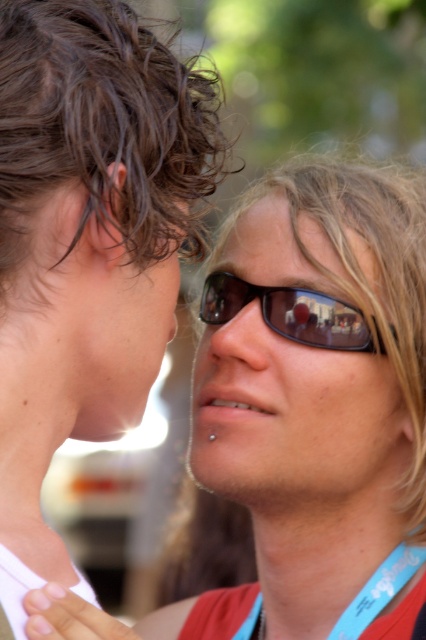
Does matte white face at left have a lesser height compared to matte black nose at center?

In fact, matte white face at left may be taller than matte black nose at center.

Between matte white face at left and matte black nose at center, which one appears on the left side from the viewer's perspective?

matte black nose at center is more to the left.

Is point (412, 620) closer to viewer compared to point (238, 317)?

Yes, point (412, 620) is in front of point (238, 317).

The image size is (426, 640). Identify the location of matte white face at left. (313, 396).

Can you confirm if matte black sunglasses at center is positioned to the left of smooth red lanyard at lower center?

Yes, matte black sunglasses at center is to the left of smooth red lanyard at lower center.

Who is taller, matte black sunglasses at center or smooth red lanyard at lower center?

→ Standing taller between the two is matte black sunglasses at center.

Looking at this image, measure the distance between point [370,440] and camera.

They are 1.11 meters apart.

Where is `matte black sunglasses at center`? matte black sunglasses at center is located at coordinates (293, 420).

Can you confirm if matte white face at left is smaller than matte skin at center?

No, matte white face at left is not smaller than matte skin at center.

What are the coordinates of `matte white face at left` in the screenshot? It's located at (313, 396).

Locate an element on the screen. The width and height of the screenshot is (426, 640). matte white face at left is located at coordinates (313, 396).